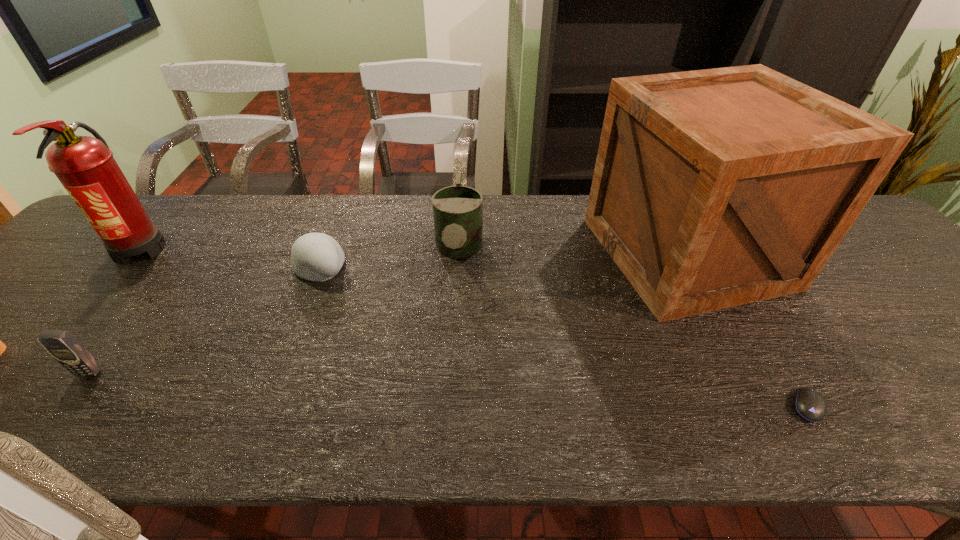
Identify the location of vacant point located between the third object from left to right and the fourth shortest object. (390, 259).

Locate an element on the screen. Image resolution: width=960 pixels, height=540 pixels. vacant space that is in between the fire extinguisher and the third object from left to right is located at coordinates (230, 257).

This screenshot has height=540, width=960. I want to click on vacant area between the fourth shortest object and the beanie, so click(x=390, y=259).

This screenshot has height=540, width=960. I want to click on object that is the third closest to the box, so click(314, 256).

Point out which object is positioned as the third nearest to the second object from left to right. Please provide its 2D coordinates. Your answer should be formatted as a tuple, i.e. [(x, y)], where the tuple contains the x and y coordinates of a point satisfying the conditions above.

[(457, 210)]

You are a GUI agent. You are given a task and a screenshot of the screen. Output one action in this format:
    pyautogui.click(x=<x>, y=<y>)
    Task: Click on the vacant space that satisfies the following two spatial constraints: 1. on the front side of the box; 2. on the left side of the shortest object
    The width and height of the screenshot is (960, 540).
    Given the screenshot: What is the action you would take?
    pyautogui.click(x=768, y=406)